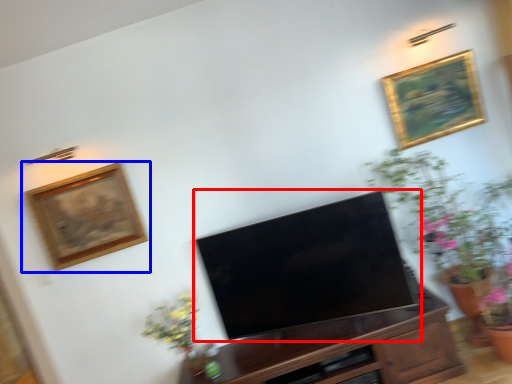
Question: Which object is closer to the camera taking this photo, television (highlighted by a red box) or picture frame (highlighted by a blue box)?

Choices:
 (A) television
 (B) picture frame

Answer: (A)